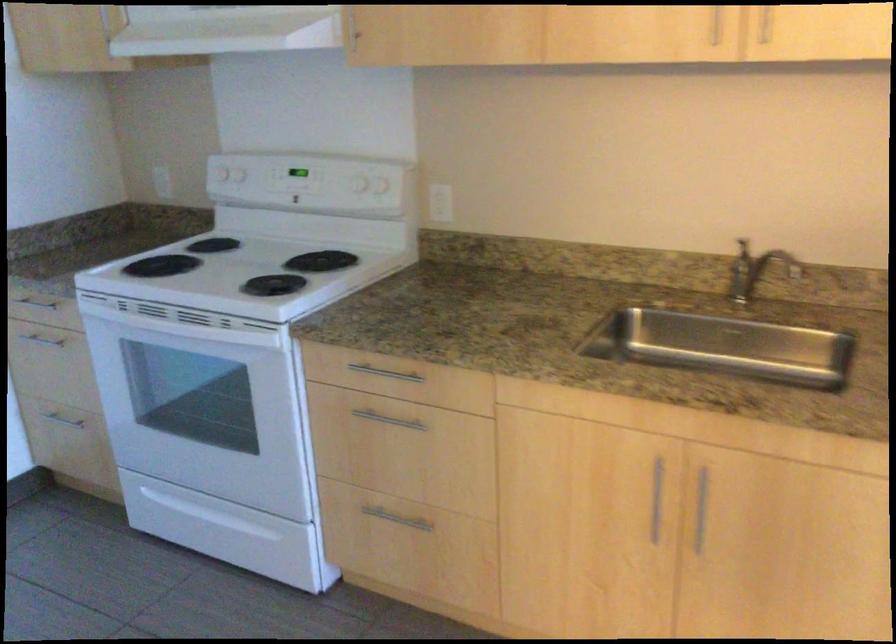
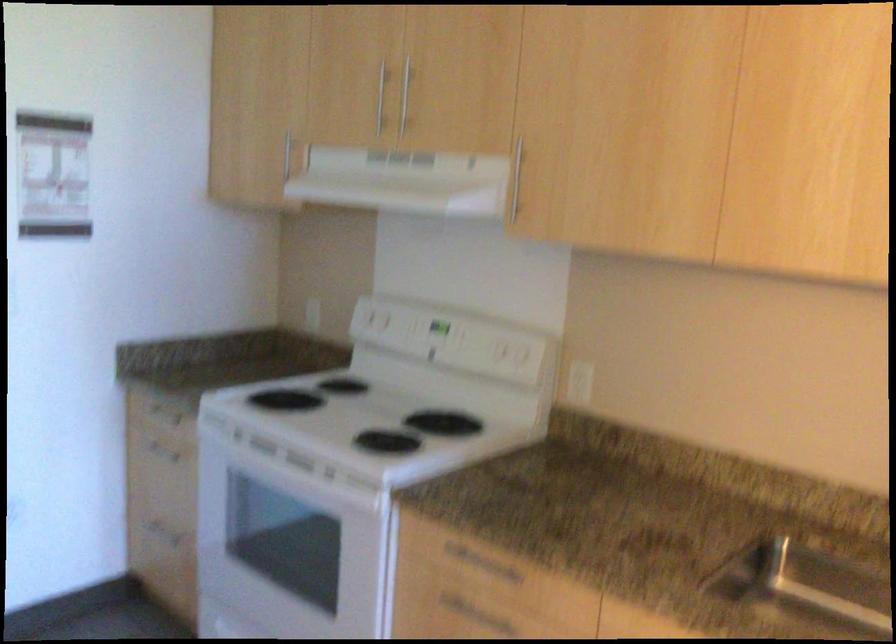
The point at (297, 401) is marked in the first image. Where is the corresponding point in the second image?

(385, 571)